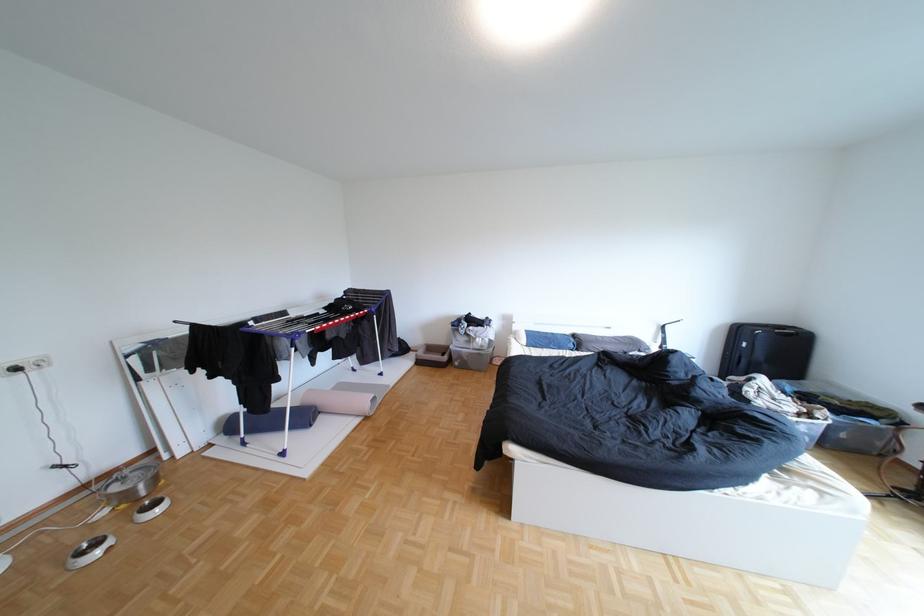
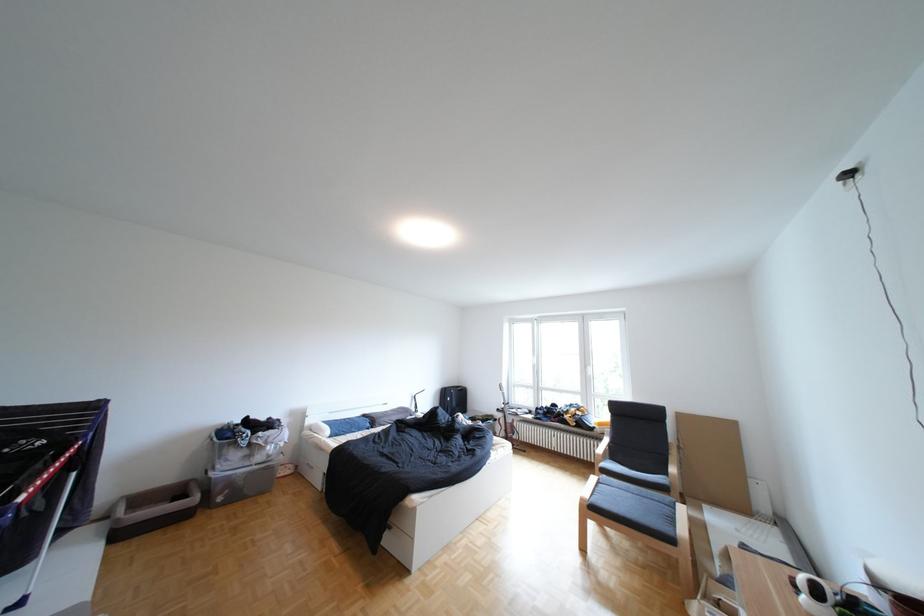
Where in the second image is the point corresponding to (483,326) from the first image?

(270, 434)